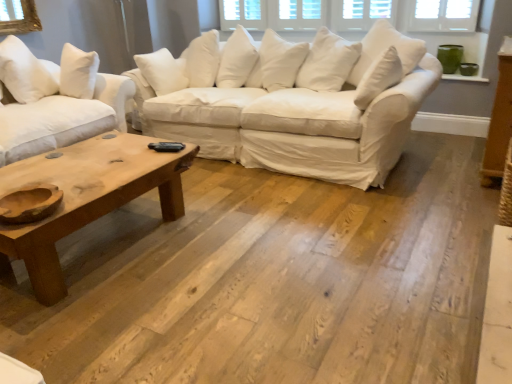
Image resolution: width=512 pixels, height=384 pixels. Find the location of `vacant space underneath natural wood coffee table at lower left (from a real-world perspective)`. vacant space underneath natural wood coffee table at lower left (from a real-world perspective) is located at coordinates (99, 241).